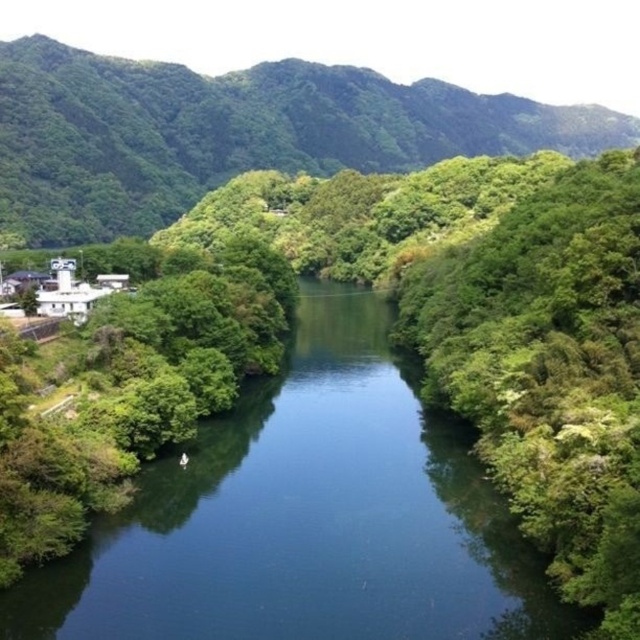
In the scene shown: You are an environmental scientist analyzing the landscape. You notice the blue smooth water at center and the green leafy mountain at upper left. Which of these two features is lower in elevation?

The blue smooth water at center has a lesser height compared to the green leafy mountain at upper left, so the blue smooth water at center is lower in elevation.

You are a hiker planning to cross the blue smooth water at center and reach the green leafy mountain at upper left. Based on the distance between them, can you estimate how long it would take to walk there if your average walking speed is 3 km per hour?

The blue smooth water at center is 504.07 meters from the green leafy mountain at upper left. Converting meters to kilometers, that distance is 0.504 kilometers. At a walking speed of 3 km per hour, it would take approximately 0.168 hours, which is roughly 10 minutes to reach the green leafy mountain at upper left.

You are a hiker standing at the edge of the river. You notice the blue smooth water at center and the green leafy mountain at upper left. Which object appears narrower from your vantage point?

The blue smooth water at center appears narrower than the green leafy mountain at upper left because it is thinner.